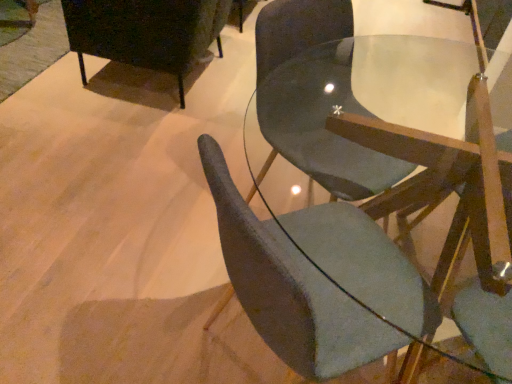
The image size is (512, 384). In order to click on vacant area situated to the left side of matte gray chair at center, the 2th chair positioned from the right in this screenshot , I will do `click(147, 309)`.